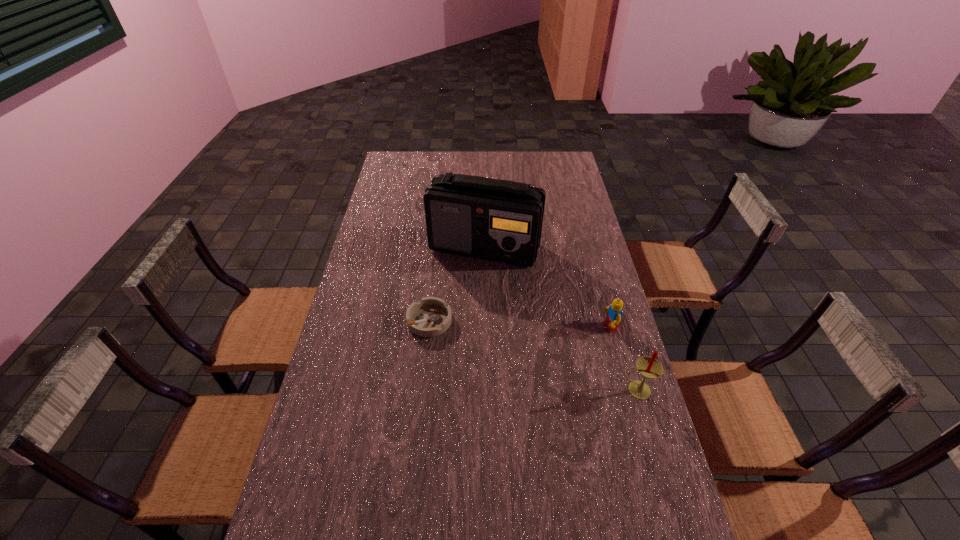
This screenshot has height=540, width=960. In order to click on vacant area that lies between the second tallest object and the radio receiver in this screenshot , I will do click(x=561, y=319).

The width and height of the screenshot is (960, 540). What are the coordinates of `object that is the third closest to the second tallest object` in the screenshot? It's located at [431, 316].

This screenshot has width=960, height=540. What are the coordinates of `object that stands as the closest to the candle` in the screenshot? It's located at (614, 313).

This screenshot has height=540, width=960. What are the coordinates of `vacant point that satisfies the following two spatial constraints: 1. on the front side of the nearest object; 2. on the right side of the radio receiver` in the screenshot? It's located at (486, 390).

Image resolution: width=960 pixels, height=540 pixels. In order to click on free location that satisfies the following two spatial constraints: 1. on the front side of the radio receiver; 2. on the left side of the nearest object in this screenshot , I will do `click(486, 390)`.

At what (x,y) coordinates should I click in order to perform the action: click on free region that satisfies the following two spatial constraints: 1. on the back side of the ashtray; 2. on the right side of the farthest object. Please return your answer as a coordinate pair (x, y). This screenshot has width=960, height=540. Looking at the image, I should click on (438, 248).